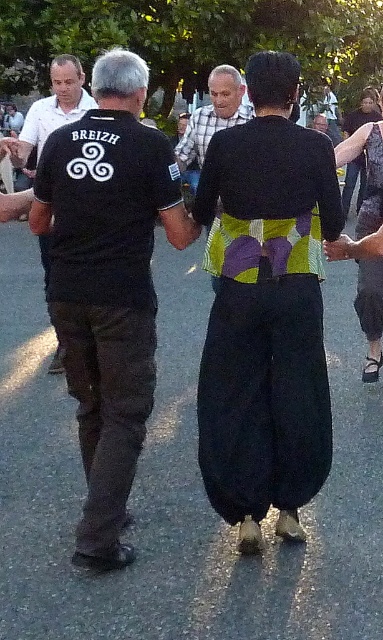
Is green textured skirt at center positioned before camouflage fabric dress at center?

Yes.

Is point (358, 296) more distant than point (361, 234)?

That is False.

Is point (368, 124) behind point (379, 321)?

Yes.

Identify the location of green textured skirt at center. (366, 241).

Which is below, black cotton pants at center or green textured skirt at center?

black cotton pants at center

Which is in front, point (266, 353) or point (371, 285)?

Point (266, 353)

Describe the element at coordinates (266, 308) in the screenshot. I see `black cotton pants at center` at that location.

This screenshot has width=383, height=640. Identify the location of black cotton pants at center. (266, 308).

Does black cotton shirt at center appear on the left side of black cotton t-shirt at left?

In fact, black cotton shirt at center is to the right of black cotton t-shirt at left.

Is point (176, 182) positioned before point (26, 140)?

Yes.

The width and height of the screenshot is (383, 640). Identify the location of black cotton shirt at center. (108, 284).